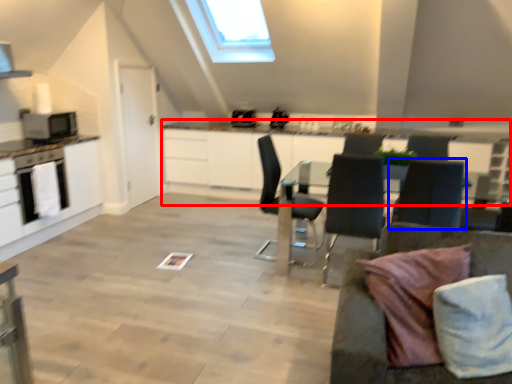
Question: Which object appears farthest to the camera in this image, counter (highlighted by a red box) or chair (highlighted by a blue box)?

Choices:
 (A) counter
 (B) chair

Answer: (A)